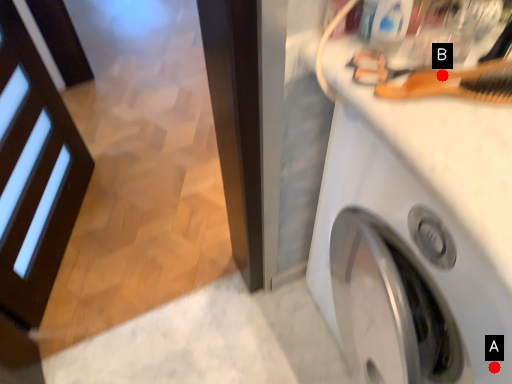
Question: Two points are circled on the image, labeled by A and B beside each circle. Which point is further to the camera?

Choices:
 (A) A is further
 (B) B is further

Answer: (A)